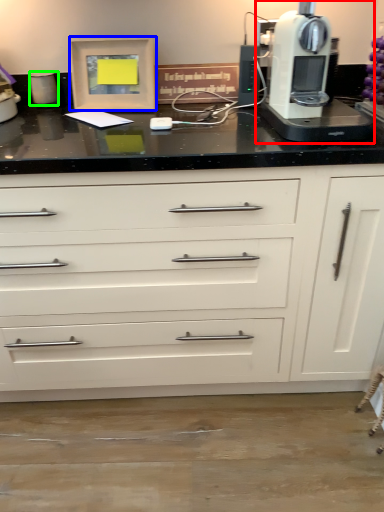
Question: Which object is the closest to the home appliance (highlighted by a red box)? Choose among these: picture frame (highlighted by a blue box) or kitchen appliance (highlighted by a green box).

Choices:
 (A) picture frame
 (B) kitchen appliance

Answer: (A)